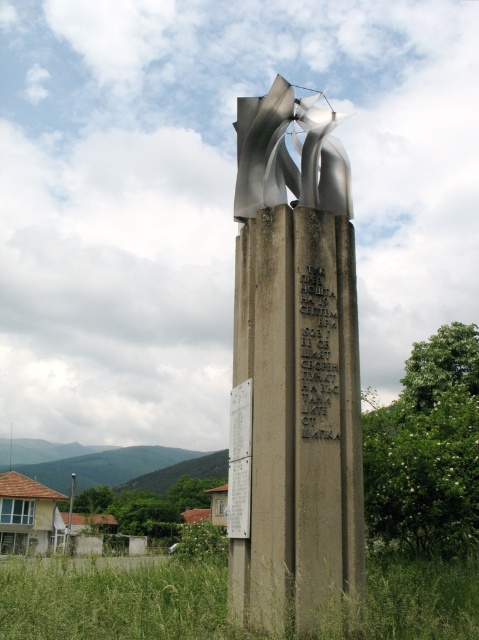
You are an archaeologist examining the monument. You notice the black stone inscription at center and the white paper at center. Which object is larger in size?

The white paper at center is larger in size compared to the black stone inscription at center.

You are a tour guide holding a white paper at center and standing near the black stone inscription at center. You need to hand the paper to a visitor who is standing 3 feet away from you. Can you reach them without moving?

The distance between the black stone inscription at center and the white paper at center is 23.13 inches. Since the visitor is 3 feet away, which is 36 inches, you cannot reach them without moving closer.

You are a tourist standing in front of the monument. You want to read the black stone inscription at center but it is currently blocked by the shiny metallic sculpture at center. How can you adjust your position to view the inscription?

The black stone inscription at center is behind the shiny metallic sculpture at center. To view the inscription, move to the side of the monument so that you can see around the sculpture to the inscription behind it.